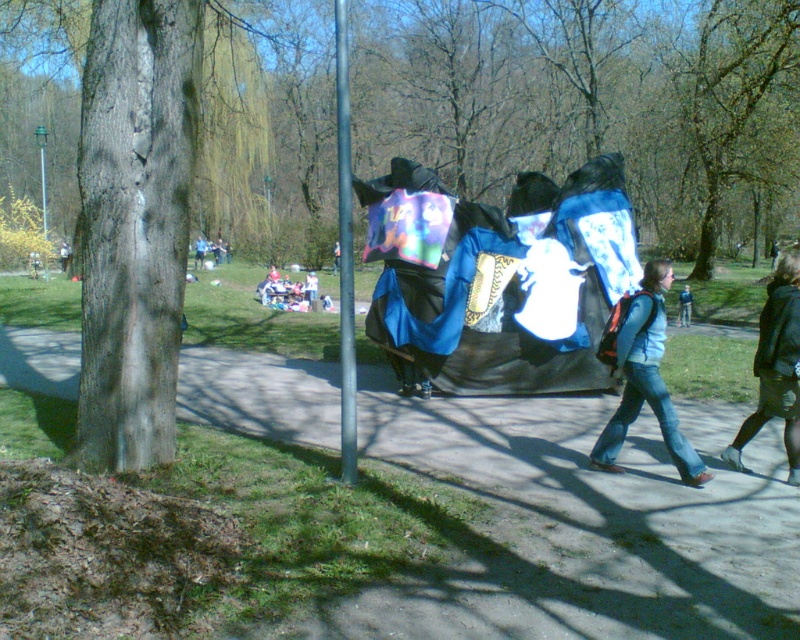
You are standing at the entrance of the park and see a metal pole near the center. There is a point marked at coordinates (645, 380). What object is this point located on?

The point at coordinates (645, 380) is located on the blue jeans at center.

You are a park visitor who wants to take a photo of the blue jeans at center and the blue fabric at center. Which one should you focus on first if you want to capture both in the same frame without moving your camera?

You should focus on the blue jeans at center first because it is much taller than the blue fabric at center, so it will occupy more space in the frame and ensure both are visible without needing to adjust the camera position.

You are a park visitor who wants to sit on the blue fabric picnic table at center. However, there are blue jeans at center in the way. Where exactly are the blue jeans positioned relative to the picnic table?

The blue jeans at center are located below the blue fabric picnic table at center, so they are underneath it.